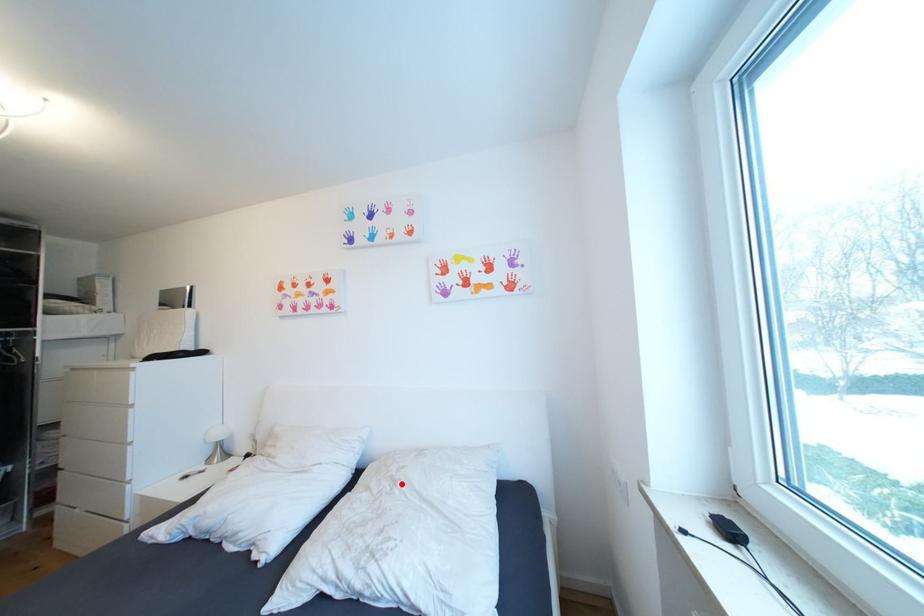
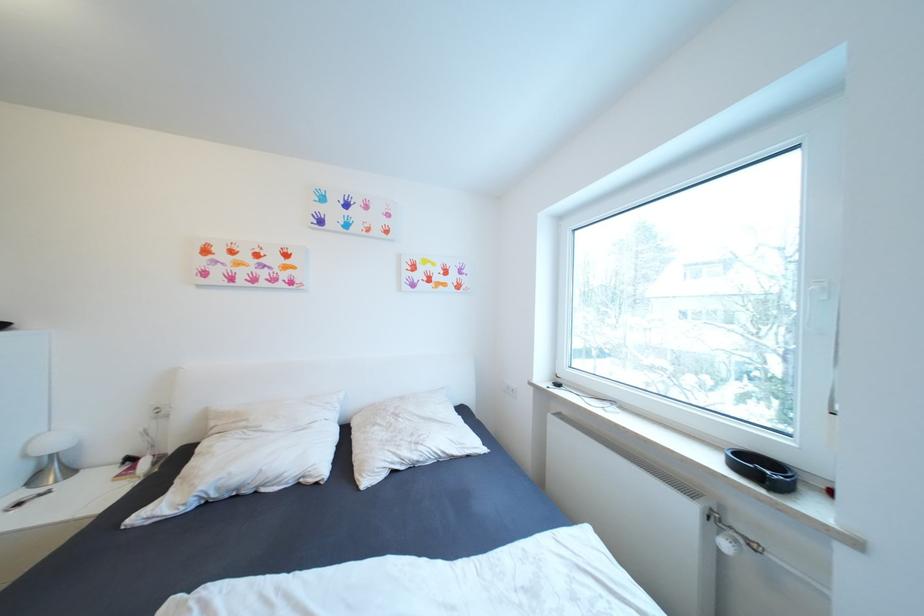
Locate, in the second image, the point that corresponds to the highlighted location in the first image.

(405, 416)